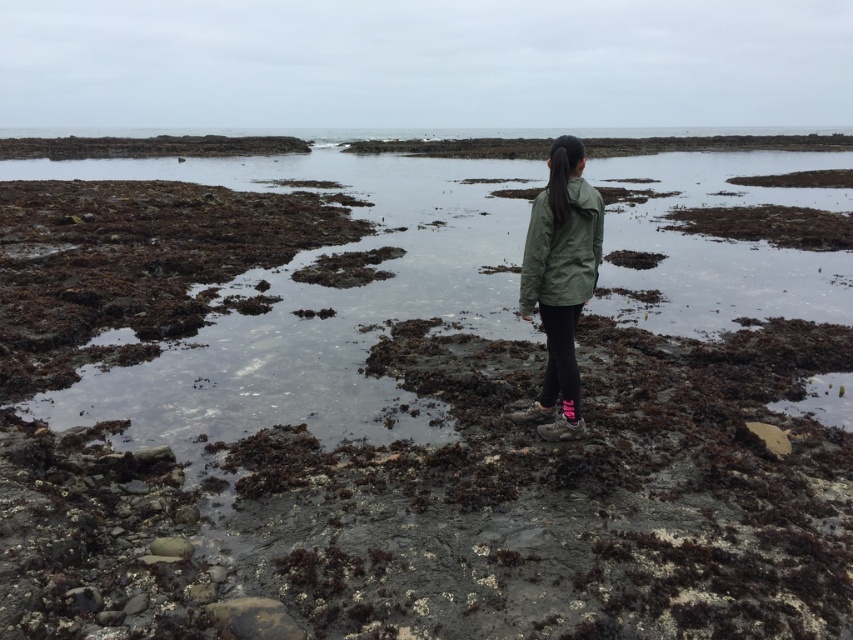
You are a hiker who has just arrived at the rocky shoreline. You need to place a GPS marker exactly where the green matte jacket at center is located. According to the coordinates provided, where should you place the GPS marker?

The green matte jacket at center is located at point coordinates (560, 282). Place the GPS marker at those coordinates.

You are a fashion designer observing the person on the rocky shoreline. You need to determine which jacket, the green matte jacket at center or the olive green fabric jacket at center, is narrower in width to decide which one to feature in your next collection. Which jacket should you choose?

The green matte jacket at center is narrower in width compared to the olive green fabric jacket at center, so you should choose the green matte jacket at center for your collection.